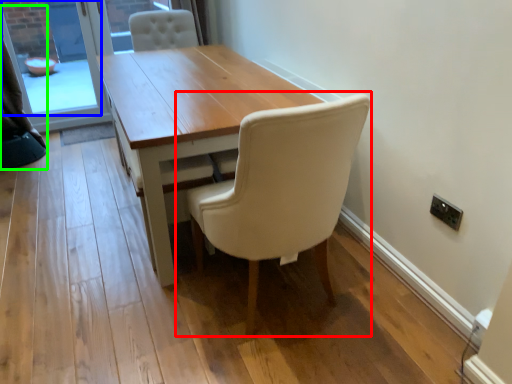
Question: Which object is the farthest from chair (highlighted by a red box)? Choose among these: window screen (highlighted by a blue box) or curtain (highlighted by a green box).

Choices:
 (A) window screen
 (B) curtain

Answer: (A)